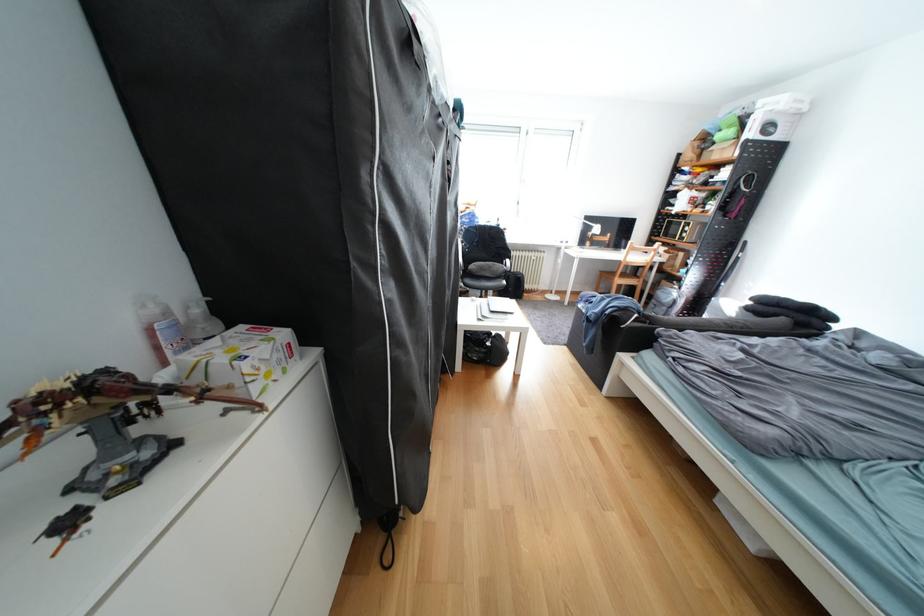
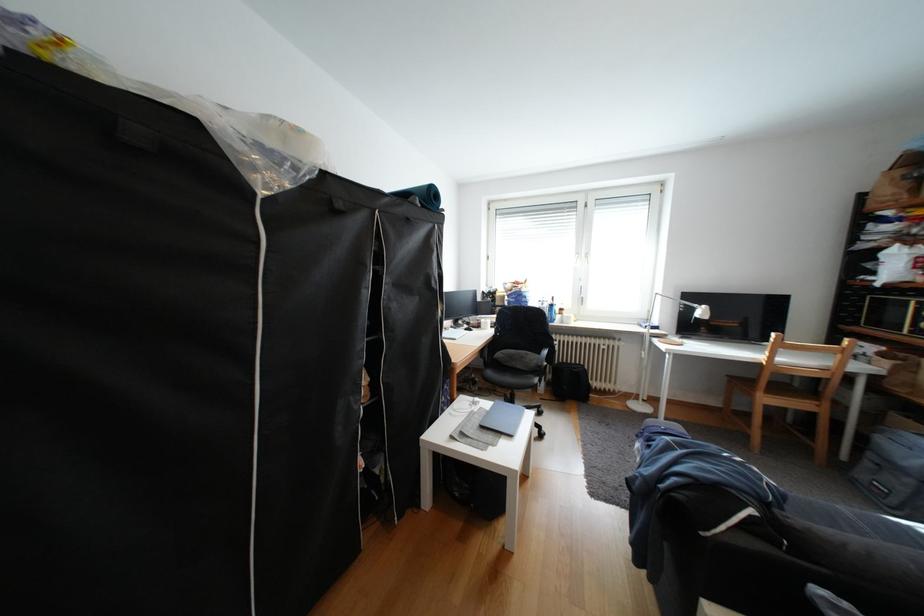
The point at (631,282) is marked in the first image. Where is the corresponding point in the second image?

(779, 400)